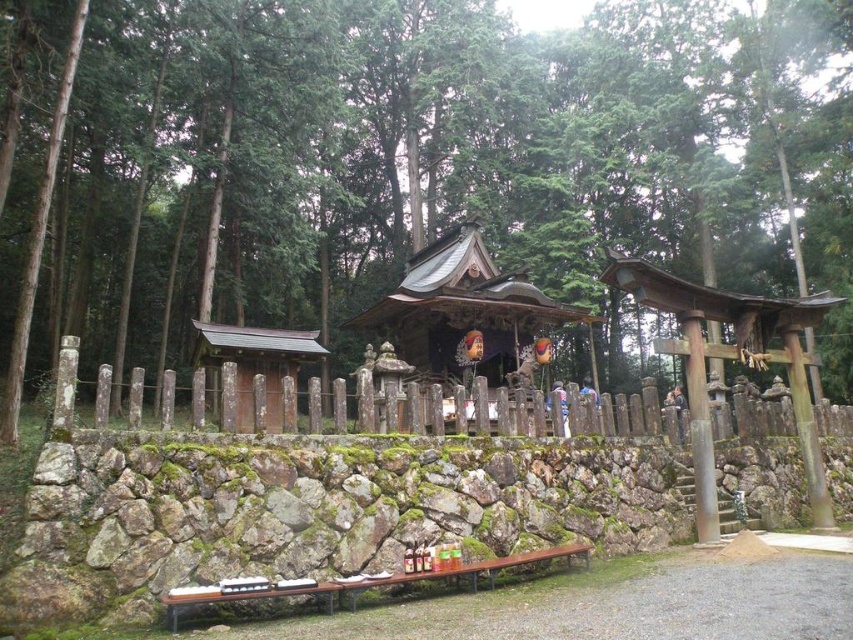
You are a visitor at the shrine and want to take a photo of the wooden shrine at center and the smooth wooden hut at left. Which one should you focus on first if you want to capture both in the same frame without moving the camera?

The wooden shrine at center is above the smooth wooden hut at left, so you should focus on the smooth wooden hut at left first to ensure both are in the frame.

You are a visitor at the shrine and want to pass through the weathered wood fence at center to reach the smooth wooden hut at left. Can you walk through the fence without bending down?

The weathered wood fence at center is wider than the smooth wooden hut at left, but the description does not provide information about the fence height. Therefore, it is uncertain whether you need to bend down to pass through the fence.

You are standing in front of the shrine complex. A map shows a treasure hidden exactly at the center point of the entire image. If you walk directly toward the wooden shrine at center, will you be moving toward the treasure location?

The wooden shrine at center is located at point (467, 314), which is very close to the center of the image. Therefore, walking directly toward the wooden shrine at center would indeed be moving toward the treasure location since the treasure is at the exact center.